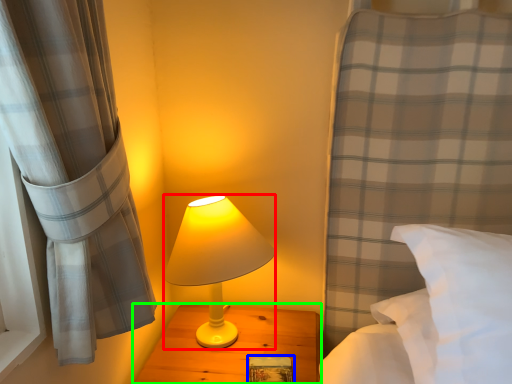
Question: Based on their relative distances, which object is farther from lamp (highlighted by a red box)? Choose from book (highlighted by a blue box) and nightstand (highlighted by a green box).

Choices:
 (A) book
 (B) nightstand

Answer: (A)